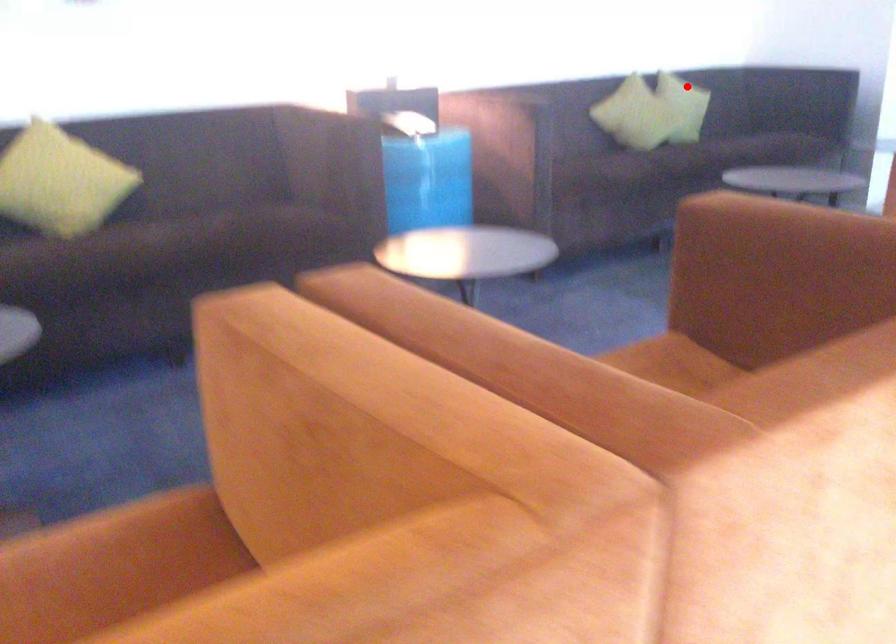
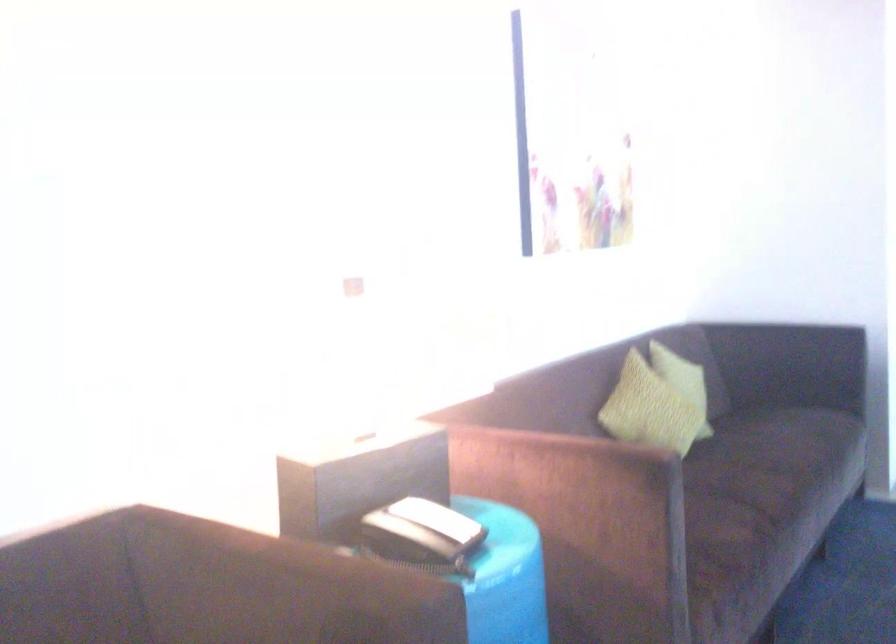
Locate, in the second image, the point that corresponds to the highlighted location in the first image.

(683, 381)